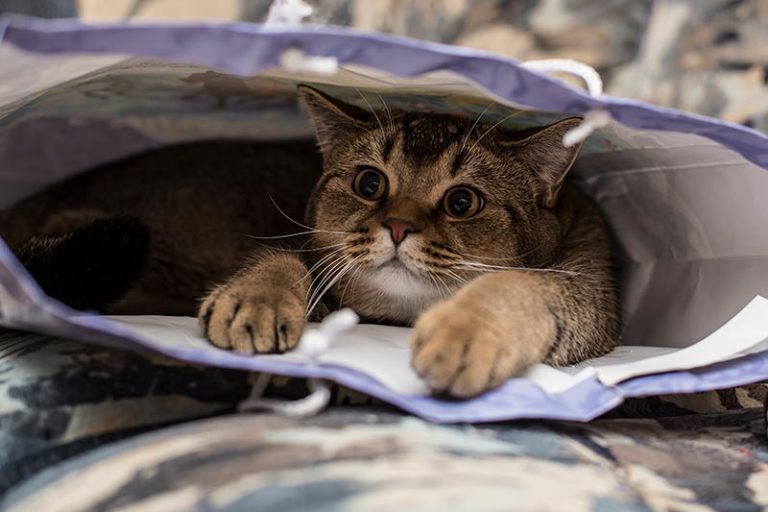
Image resolution: width=768 pixels, height=512 pixels. I want to click on chair/sofa, so (x=326, y=460), (x=651, y=76).